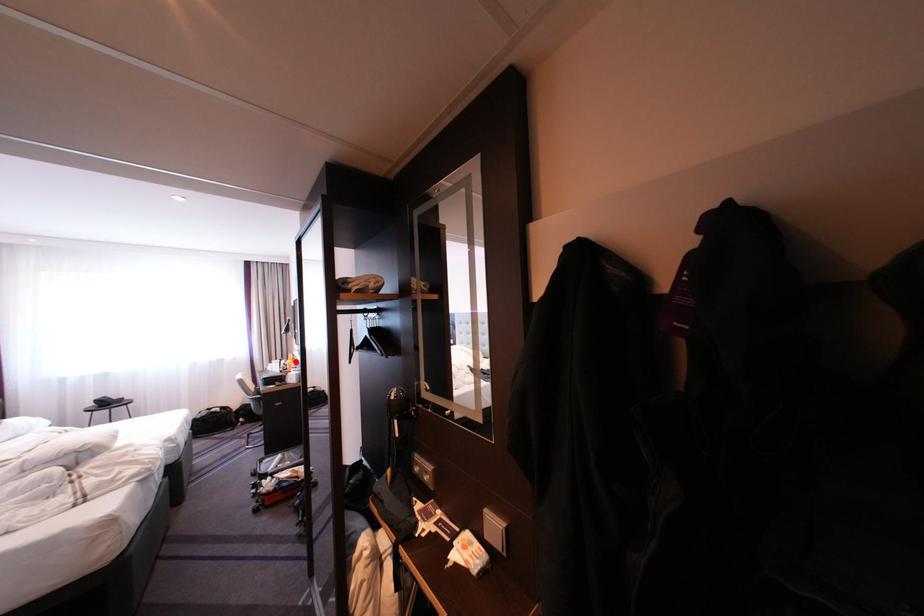
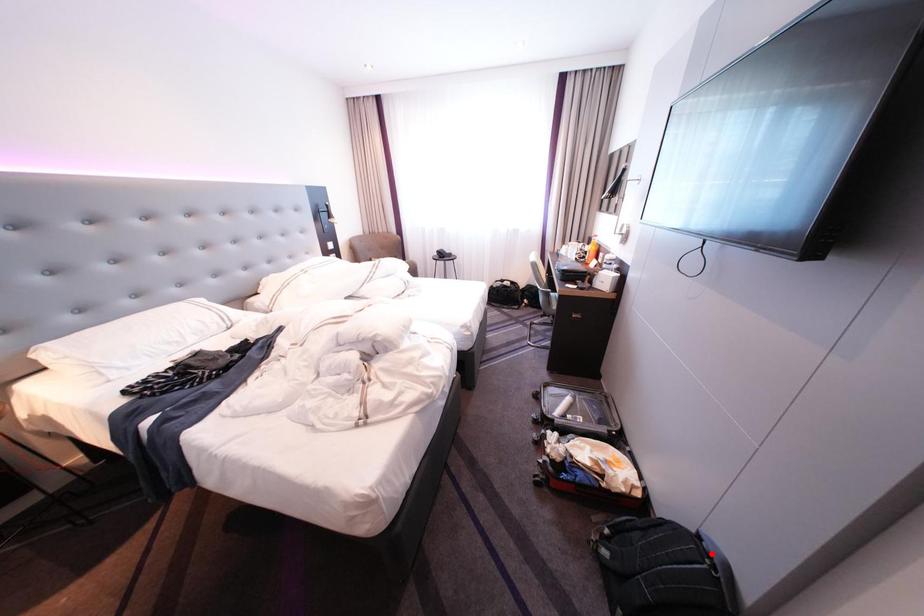
I am providing you with two images of the same scene from different viewpoints. A red point is marked on the first image and another point is marked on the second image. Does the point marked in image1 correspond to the same location as the one in image2?

No